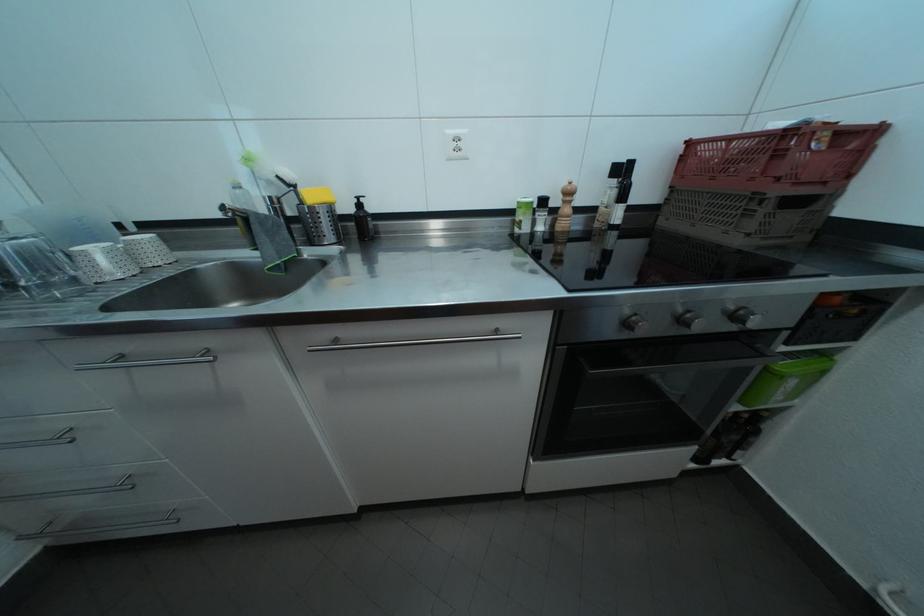
Where is `red plastic crate`? The height and width of the screenshot is (616, 924). red plastic crate is located at coordinates (777, 158).